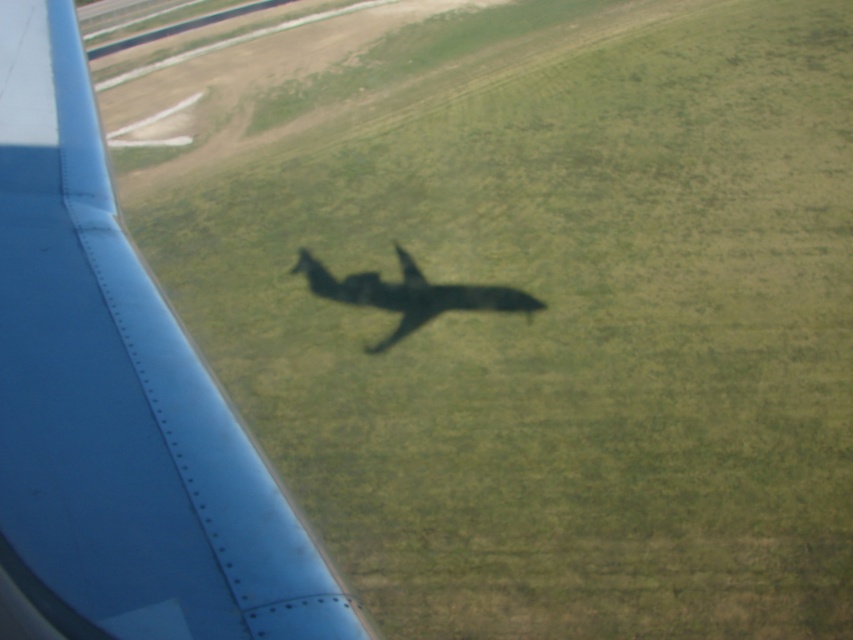
Question: Which of the following is the closest to the observer?

Choices:
 (A) (473, 296)
 (B) (146, 387)

Answer: (B)

Question: Which object is farther from the camera taking this photo?

Choices:
 (A) shiny metallic airplane at center
 (B) matte blue wing at left

Answer: (A)

Question: Can you confirm if matte blue wing at left is positioned to the right of shiny metallic airplane at center?

Choices:
 (A) yes
 (B) no

Answer: (A)

Question: Is matte blue wing at left in front of shiny metallic airplane at center?

Choices:
 (A) yes
 (B) no

Answer: (A)

Question: Which of the following is the closest to the observer?

Choices:
 (A) (473, 296)
 (B) (4, 400)

Answer: (B)

Question: Is matte blue wing at left positioned in front of shiny metallic airplane at center?

Choices:
 (A) yes
 (B) no

Answer: (A)